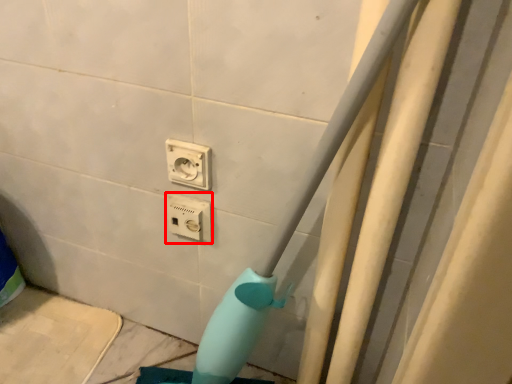
Question: From the image's perspective, considering the relative positions of power plugs and sockets (annotated by the red box) and power plugs and sockets in the image provided, where is power plugs and sockets (annotated by the red box) located with respect to the staircase?

Choices:
 (A) above
 (B) below

Answer: (B)